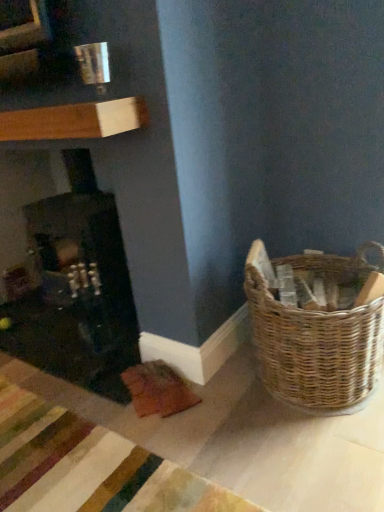
Question: Looking at their shapes, would you say matte black fireplace at left is wider or thinner than woven brown basket at lower right?

Choices:
 (A) thin
 (B) wide

Answer: (B)

Question: Relative to woven brown basket at lower right, is matte black fireplace at left in front or behind?

Choices:
 (A) front
 (B) behind

Answer: (B)

Question: From a real-world perspective, is matte black fireplace at left physically located above or below woven brown basket at lower right?

Choices:
 (A) above
 (B) below

Answer: (A)

Question: Which is correct: woven brown basket at lower right is inside matte black fireplace at left, or outside of it?

Choices:
 (A) inside
 (B) outside

Answer: (B)

Question: Is point (271, 296) positioned closer to the camera than point (104, 336)?

Choices:
 (A) farther
 (B) closer

Answer: (B)

Question: From the image's perspective, is woven brown basket at lower right positioned above or below matte black fireplace at left?

Choices:
 (A) below
 (B) above

Answer: (A)

Question: From a real-world perspective, relative to matte black fireplace at left, is woven brown basket at lower right vertically above or below?

Choices:
 (A) below
 (B) above

Answer: (A)